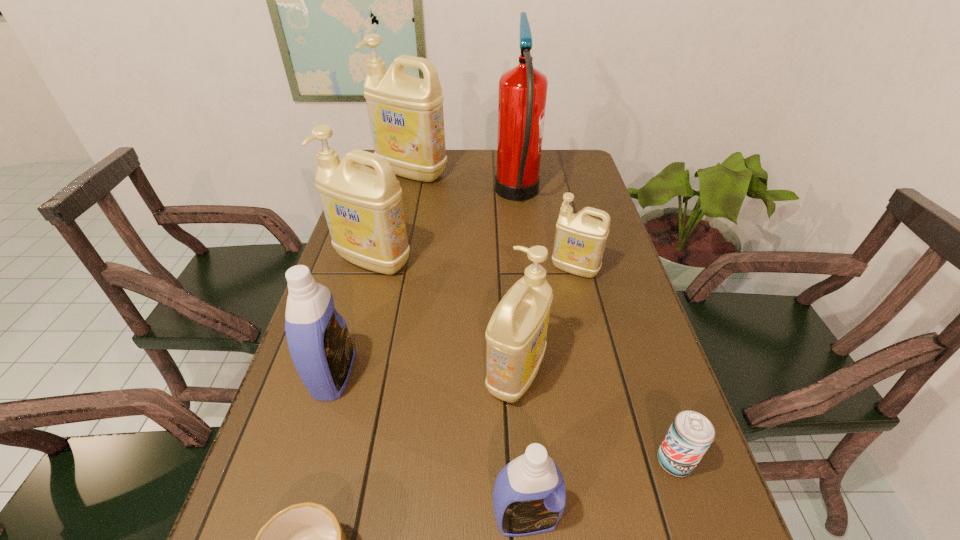
In order to click on vacant space located on the back of the rightmost beige detergent in this screenshot , I will do `click(568, 242)`.

Find the location of a particular element. This screenshot has height=540, width=960. vacant space situated on the back of the nearest detergent is located at coordinates (516, 377).

Identify the location of vacant space located 0.060m on the front of the seventh farthest object. This screenshot has height=540, width=960. [x=692, y=515].

The image size is (960, 540). What are the coordinates of `fire extinguisher positioned at the far edge` in the screenshot? It's located at (522, 95).

Identify the location of detergent that is at the far edge. (406, 116).

Where is `detergent at the right edge`? The image size is (960, 540). detergent at the right edge is located at coordinates (580, 240).

In order to click on beer can that is at the right edge in this screenshot , I will do `click(690, 435)`.

At what (x,y) coordinates should I click in order to perform the action: click on object located in the far left corner section of the desktop. Please return your answer as a coordinate pair (x, y). Looking at the image, I should click on (406, 116).

This screenshot has width=960, height=540. In order to click on free space at the left edge of the desktop in this screenshot , I will do [406, 200].

Identify the location of vacant area at the right edge of the desktop. (630, 384).